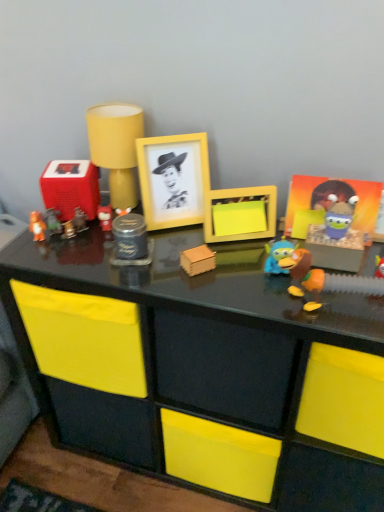
Question: From a real-world perspective, is metallic gold toy at center-left, marked as the 9th toy in a right-to-left arrangement, on yellow matte frame at center, the third toy positioned from the right?

Choices:
 (A) yes
 (B) no

Answer: (B)

Question: Can you confirm if metallic gold toy at center-left, marked as the 9th toy in a right-to-left arrangement, is positioned to the right of yellow matte frame at center, the third toy positioned from the right?

Choices:
 (A) no
 (B) yes

Answer: (A)

Question: Considering the relative sizes of metallic gold toy at center-left, marked as the 9th toy in a right-to-left arrangement, and yellow matte frame at center, which is counted as the tenth toy, starting from the left, in the image provided, is metallic gold toy at center-left, marked as the 9th toy in a right-to-left arrangement, smaller than yellow matte frame at center, which is counted as the tenth toy, starting from the left,?

Choices:
 (A) yes
 (B) no

Answer: (A)

Question: Would you say yellow matte frame at center, the third toy positioned from the right, is part of metallic gold toy at center-left, the 4th toy when ordered from left to right,'s contents?

Choices:
 (A) no
 (B) yes

Answer: (A)

Question: Is metallic gold toy at center-left, marked as the 9th toy in a right-to-left arrangement, at the left side of yellow matte frame at center, which is counted as the tenth toy, starting from the left?

Choices:
 (A) no
 (B) yes

Answer: (B)

Question: Is metallic gold toy at center-left, the 4th toy when ordered from left to right, directly adjacent to yellow matte frame at center, which is counted as the tenth toy, starting from the left?

Choices:
 (A) no
 (B) yes

Answer: (A)

Question: Is glossy black desk at center wider than rubberized plastic speaker at left, the tenth toy viewed from the right?

Choices:
 (A) yes
 (B) no

Answer: (A)

Question: Is glossy black desk at center facing away from rubberized plastic speaker at left, the tenth toy viewed from the right?

Choices:
 (A) no
 (B) yes

Answer: (A)

Question: Does glossy black desk at center lie in front of rubberized plastic speaker at left, placed as the 3th toy when sorted from left to right?

Choices:
 (A) no
 (B) yes

Answer: (B)

Question: Is glossy black desk at center to the right of rubberized plastic speaker at left, the tenth toy viewed from the right, from the viewer's perspective?

Choices:
 (A) yes
 (B) no

Answer: (A)

Question: From the image's perspective, would you say glossy black desk at center is positioned over rubberized plastic speaker at left, the tenth toy viewed from the right?

Choices:
 (A) yes
 (B) no

Answer: (B)

Question: Is rubberized plastic speaker at left, the tenth toy viewed from the right, surrounded by glossy black desk at center?

Choices:
 (A) no
 (B) yes

Answer: (A)

Question: From a real-world perspective, is orange matte bear at left, which is the 1th toy in left-to-right order, physically above blue rubber duck at center, which is counted as the eleventh toy, starting from the left?

Choices:
 (A) no
 (B) yes

Answer: (A)